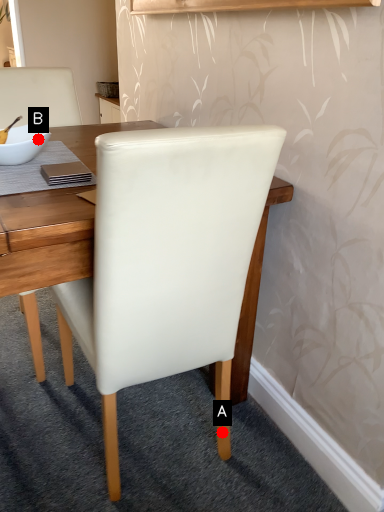
Question: Two points are circled on the image, labeled by A and B beside each circle. Which point is closer to the camera?

Choices:
 (A) A is closer
 (B) B is closer

Answer: (B)